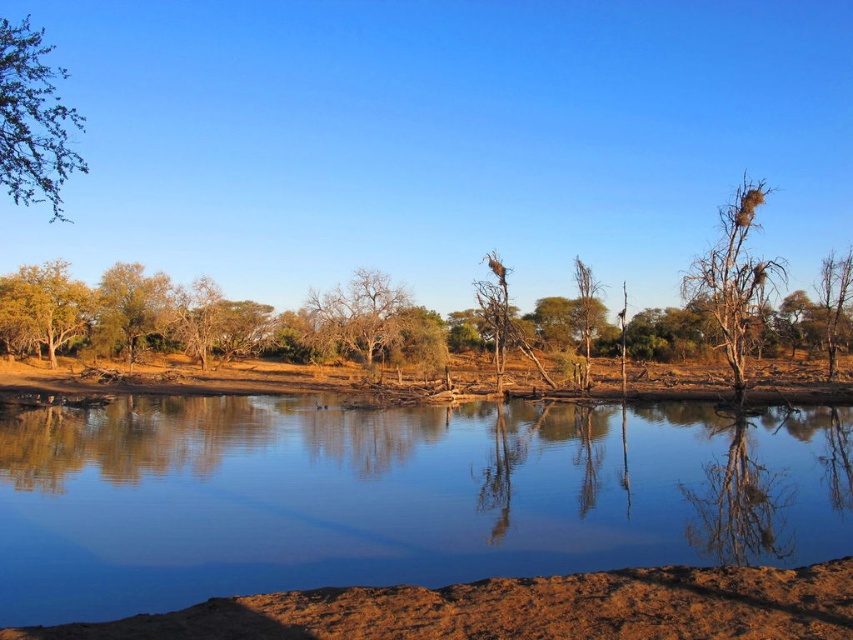
Who is positioned more to the left, yellow-green leafy tree at left or brown dry tree at center?

yellow-green leafy tree at left is more to the left.

Does yellow-green leafy tree at left have a lesser height compared to brown dry tree at center?

No.

Locate an element on the screen. This screenshot has height=640, width=853. yellow-green leafy tree at left is located at coordinates (42, 308).

Is transparent water at center taller than green leafy tree at left?

In fact, transparent water at center may be shorter than green leafy tree at left.

Is point (418, 420) positioned after point (103, 300)?

No, it is not.

Where is `transparent water at center`? Image resolution: width=853 pixels, height=640 pixels. transparent water at center is located at coordinates (396, 496).

Is point (715, 248) behind point (341, 292)?

No, it is in front of (341, 292).

Where is `brown dry branches at right`? brown dry branches at right is located at coordinates (734, 276).